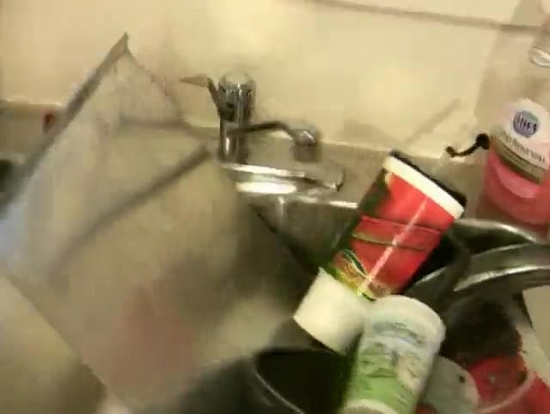
Image resolution: width=550 pixels, height=414 pixels. I want to click on white wall, so click(x=366, y=48).